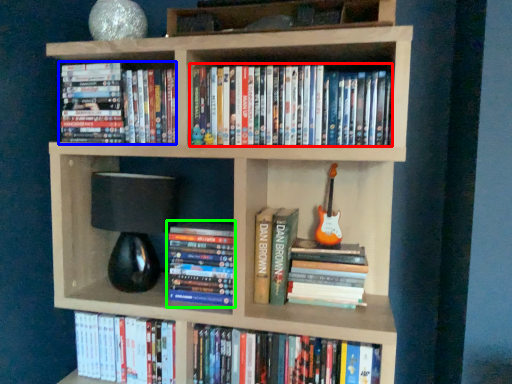
Question: Which object is the farthest from book (highlighted by a red box)? Choose among these: book (highlighted by a blue box) or book (highlighted by a green box).

Choices:
 (A) book
 (B) book

Answer: (B)